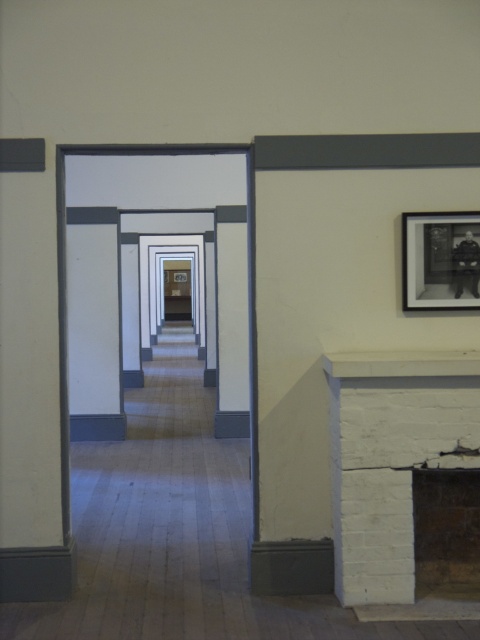
Looking at this image, you are standing in the corridor and want to locate the white painted brick fireplace at lower right. According to the coordinates provided, where should you look relative to your current position?

You should look towards the lower right direction, as the white painted brick fireplace at lower right is located at point (392, 458) which corresponds to the lower right area of the image.

You are standing at the entrance of the corridor and want to locate both the white painted brick fireplace at lower right and the black matte picture frame at upper right. Which object is closer to the entrance?

The white painted brick fireplace at lower right is closer to the entrance because it is positioned under the black matte picture frame at upper right, meaning it is lower in the corridor and thus nearer to where you are standing.